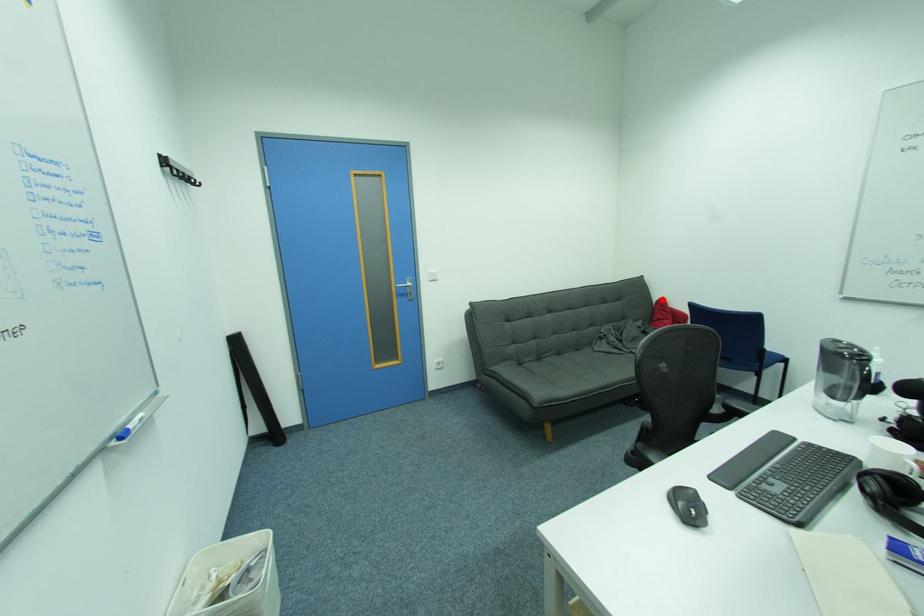
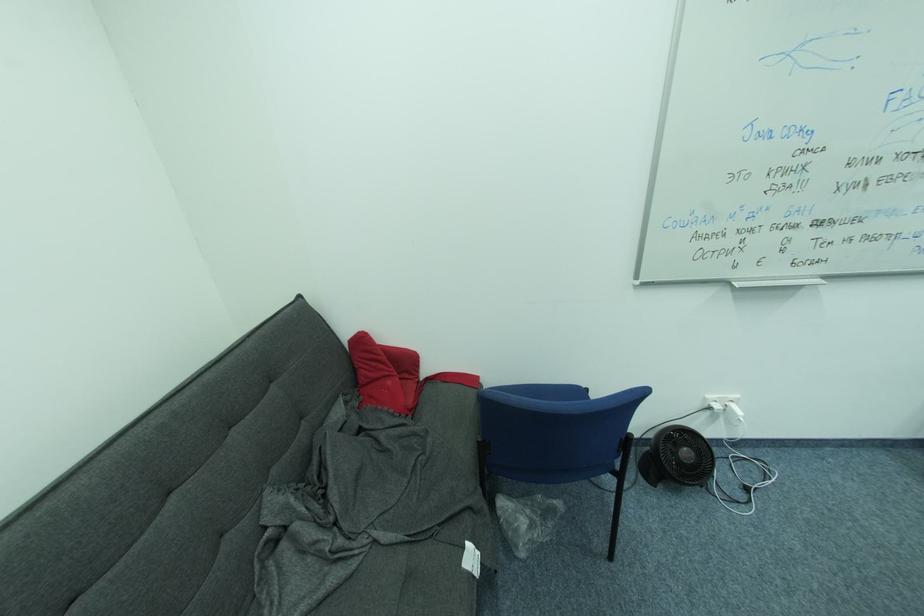
Question: I am providing you with two images of the same scene from different viewpoints. A red point is marked on the first image. Can you still see the location of the red point in image 2?

Choices:
 (A) Yes
 (B) No

Answer: (A)